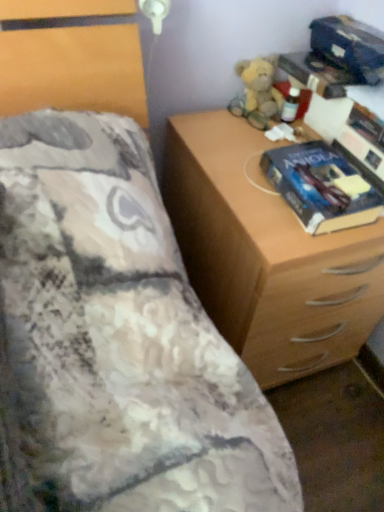
Question: Is wooden chest of drawers at right situated inside fluffy beige teddy bear at upper right or outside?

Choices:
 (A) outside
 (B) inside

Answer: (A)

Question: Does point (x=163, y=156) appear closer or farther from the camera than point (x=233, y=102)?

Choices:
 (A) farther
 (B) closer

Answer: (A)

Question: Which is nearer to the blue glossy paperback book at right?

Choices:
 (A) fluffy beige teddy bear at upper right
 (B) wooden chest of drawers at right

Answer: (B)

Question: Which of these objects is positioned closest to the fluffy beige teddy bear at upper right?

Choices:
 (A) wooden chest of drawers at right
 (B) blue glossy paperback book at right

Answer: (B)